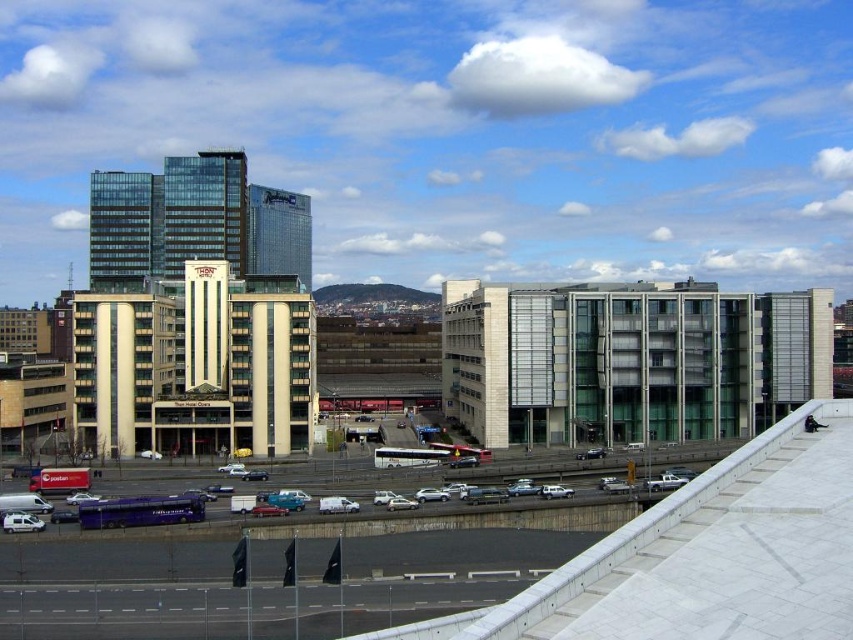
Is point (587, 518) closer to viewer compared to point (16, 531)?

No, (587, 518) is further to viewer.

Who is more distant from viewer, (96, 529) or (32, 518)?

The point (32, 518) is behind.

At what (x,y) coordinates should I click in order to perform the action: click on matte blue bus at center. Please return your answer as a coordinate pair (x, y). Looking at the image, I should click on (438, 516).

How far apart are matte blue bus at center and white matte car at center?

A distance of 9.30 meters exists between matte blue bus at center and white matte car at center.

From the picture: Is matte blue bus at center smaller than white matte car at center?

Actually, matte blue bus at center might be larger than white matte car at center.

Identify the location of matte blue bus at center. (x=438, y=516).

The height and width of the screenshot is (640, 853). I want to click on matte blue bus at center, so click(x=438, y=516).

Who is lower down, white matte van at lower left or white matte car at center?

white matte van at lower left

Is point (4, 516) farther from viewer compared to point (404, 499)?

No, it is in front of (404, 499).

You are a GUI agent. You are given a task and a screenshot of the screen. Output one action in this format:
    pyautogui.click(x=<x>, y=<y>)
    Task: Click on the white matte van at lower left
    
    Given the screenshot: What is the action you would take?
    pyautogui.click(x=22, y=522)